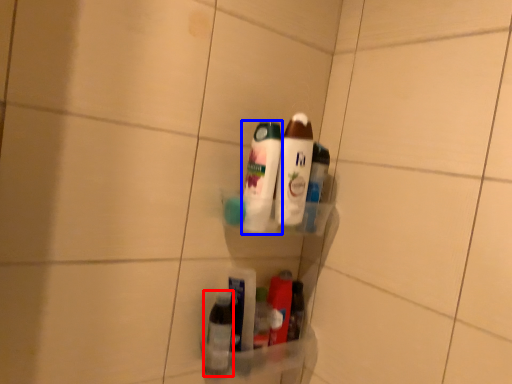
Question: Which of the following is the farthest to the observer, bottle (highlighted by a red box) or bottle (highlighted by a blue box)?

Choices:
 (A) bottle
 (B) bottle

Answer: (A)